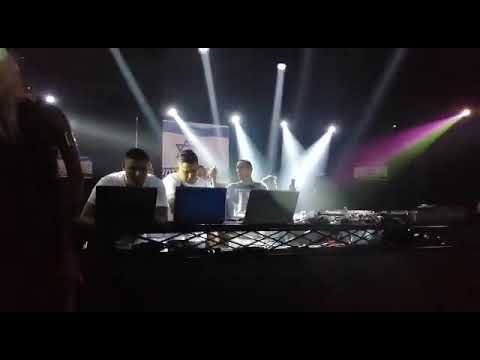
You are a GUI agent. You are given a task and a screenshot of the screen. Output one action in this format:
    pyautogui.click(x=<x>, y=<y>)
    Task: Click on the very dark gray laptop lid
    This screenshot has height=360, width=480.
    Given the screenshot: What is the action you would take?
    pyautogui.click(x=263, y=207)